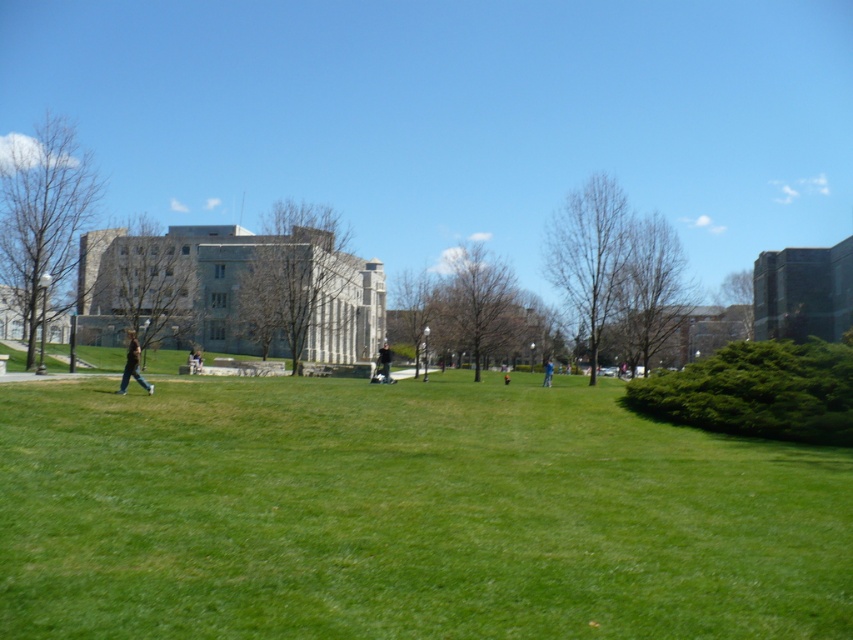
Question: Can you confirm if dark blue jeans at center is smaller than blue fabric person at center?

Choices:
 (A) no
 (B) yes

Answer: (A)

Question: Is light brown leather jacket at left positioned at the back of light brown leather jacket at center?

Choices:
 (A) no
 (B) yes

Answer: (A)

Question: Which object is farther from the camera taking this photo?

Choices:
 (A) light brown leather jacket at center
 (B) light brown leather jacket at left
 (C) dark blue jeans at center
 (D) green grass at center

Answer: (A)

Question: Does green grass at center lie in front of light brown leather jacket at left?

Choices:
 (A) yes
 (B) no

Answer: (A)

Question: Which object appears closest to the camera in this image?

Choices:
 (A) dark blue jeans at center
 (B) green grass at center

Answer: (B)

Question: Estimate the real-world distances between objects in this image. Which object is closer to the blue fabric person at center?

Choices:
 (A) light brown leather jacket at left
 (B) dark blue jeans at center

Answer: (B)